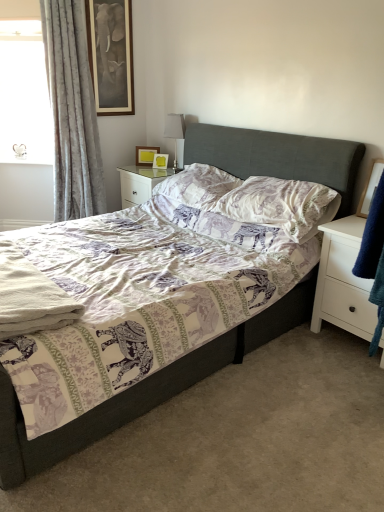
Question: Should I look upward or downward to see silky gray curtain at left?

Choices:
 (A) down
 (B) up

Answer: (B)

Question: Is matte yellow picture frame at upper center, arranged as the first picture frame when viewed from the left, positioned beyond the bounds of silky gray curtain at left?

Choices:
 (A) no
 (B) yes

Answer: (B)

Question: Can you confirm if matte yellow picture frame at upper center, arranged as the first picture frame when viewed from the left, is wider than silky gray curtain at left?

Choices:
 (A) no
 (B) yes

Answer: (A)

Question: From a real-world perspective, is matte yellow picture frame at upper center, the first picture frame from the top, positioned over silky gray curtain at left based on gravity?

Choices:
 (A) yes
 (B) no

Answer: (B)

Question: Does matte yellow picture frame at upper center, the first picture frame from the top, appear on the right side of silky gray curtain at left?

Choices:
 (A) yes
 (B) no

Answer: (A)

Question: Is matte yellow picture frame at upper center, which is the second picture frame from front to back, thinner than silky gray curtain at left?

Choices:
 (A) no
 (B) yes

Answer: (B)

Question: Is matte yellow picture frame at upper center, arranged as the first picture frame when viewed from the left, aimed at silky gray curtain at left?

Choices:
 (A) yes
 (B) no

Answer: (B)

Question: Is the position of matte yellow picture frame at upper center, marked as the 2th picture frame in a right-to-left arrangement, more distant than that of satin silver table lamp at upper center?

Choices:
 (A) no
 (B) yes

Answer: (B)

Question: From the image's perspective, does matte yellow picture frame at upper center, marked as the 2th picture frame in a right-to-left arrangement, appear higher than satin silver table lamp at upper center?

Choices:
 (A) yes
 (B) no

Answer: (B)

Question: Does matte yellow picture frame at upper center, which ranks as the 2th picture frame in bottom-to-top order, appear on the right side of satin silver table lamp at upper center?

Choices:
 (A) no
 (B) yes

Answer: (A)

Question: From the image's perspective, is matte yellow picture frame at upper center, the first picture frame in the back-to-front sequence, below satin silver table lamp at upper center?

Choices:
 (A) yes
 (B) no

Answer: (A)

Question: Is matte yellow picture frame at upper center, the first picture frame in the back-to-front sequence, bigger than satin silver table lamp at upper center?

Choices:
 (A) yes
 (B) no

Answer: (B)

Question: Considering the relative sizes of matte yellow picture frame at upper center, which is the second picture frame from front to back, and satin silver table lamp at upper center in the image provided, is matte yellow picture frame at upper center, which is the second picture frame from front to back, thinner than satin silver table lamp at upper center?

Choices:
 (A) yes
 (B) no

Answer: (A)

Question: Is silky gray curtain at left next to printed fabric pillow at center, acting as the 2th pillow starting from the back?

Choices:
 (A) no
 (B) yes

Answer: (A)